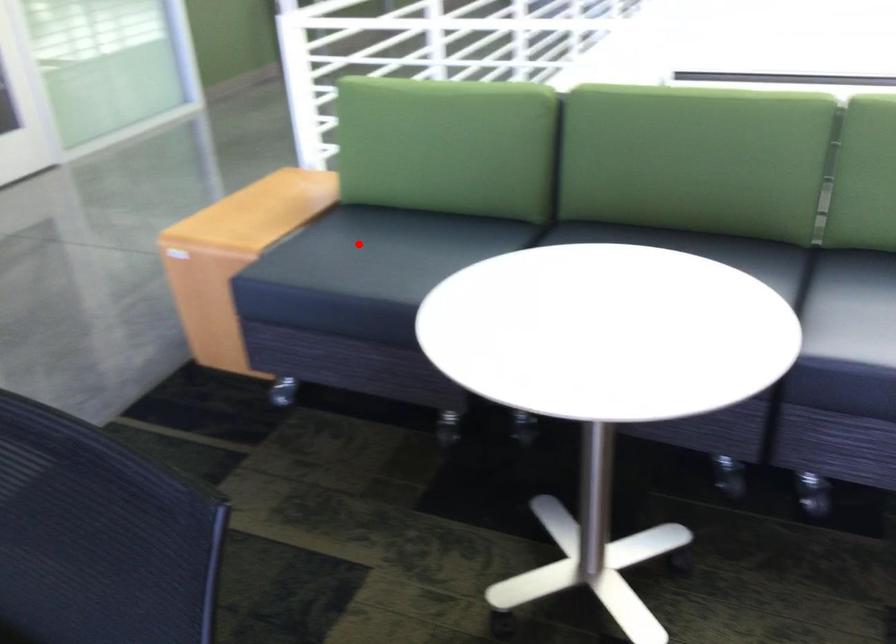
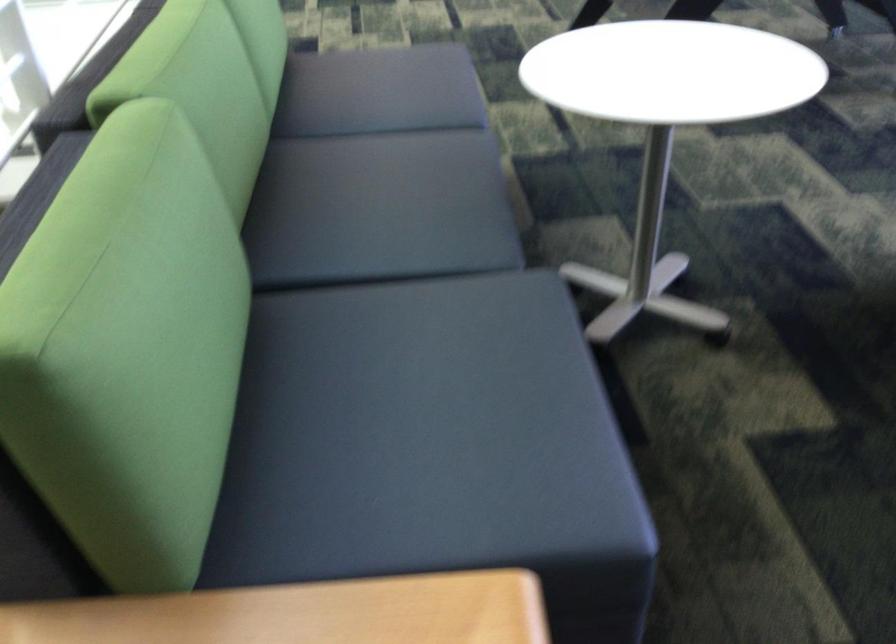
Where in the second image is the point corresponding to the highlighted location from the first image?

(423, 438)